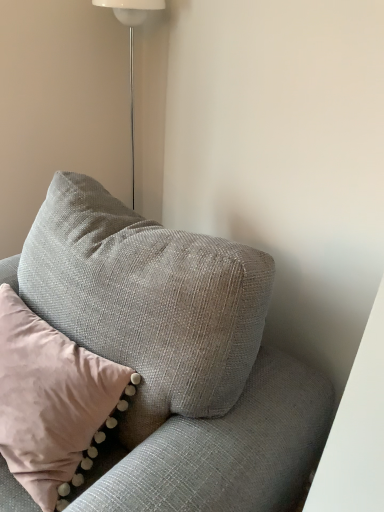
Question: From the image's perspective, is textured gray pillow at upper left under white glossy floor lamp at upper center?

Choices:
 (A) no
 (B) yes

Answer: (B)

Question: Could you tell me if textured gray pillow at upper left is turned towards white glossy floor lamp at upper center?

Choices:
 (A) no
 (B) yes

Answer: (A)

Question: Is white glossy floor lamp at upper center a part of textured gray pillow at upper left?

Choices:
 (A) no
 (B) yes

Answer: (A)

Question: Is textured gray pillow at upper left positioned beyond the bounds of white glossy floor lamp at upper center?

Choices:
 (A) yes
 (B) no

Answer: (A)

Question: Considering the relative sizes of textured gray pillow at upper left and white glossy floor lamp at upper center in the image provided, is textured gray pillow at upper left wider than white glossy floor lamp at upper center?

Choices:
 (A) yes
 (B) no

Answer: (A)

Question: In the image, is white glossy floor lamp at upper center on the left side or the right side of textured gray pillow at upper left?

Choices:
 (A) left
 (B) right

Answer: (B)

Question: Is point (124, 1) positioned closer to the camera than point (34, 463)?

Choices:
 (A) closer
 (B) farther

Answer: (B)

Question: From a real-world perspective, is white glossy floor lamp at upper center physically located above or below textured gray pillow at upper left?

Choices:
 (A) above
 (B) below

Answer: (A)

Question: Would you say white glossy floor lamp at upper center is inside or outside textured gray pillow at upper left?

Choices:
 (A) outside
 (B) inside

Answer: (A)

Question: In the image, is textured gray couch at upper right on the left side or the right side of textured gray pillow at upper left?

Choices:
 (A) right
 (B) left

Answer: (A)

Question: Is textured gray couch at upper right bigger or smaller than textured gray pillow at upper left?

Choices:
 (A) small
 (B) big

Answer: (B)

Question: Looking at their shapes, would you say textured gray couch at upper right is wider or thinner than textured gray pillow at upper left?

Choices:
 (A) thin
 (B) wide

Answer: (B)

Question: Considering their positions, is textured gray couch at upper right located in front of or behind textured gray pillow at upper left?

Choices:
 (A) front
 (B) behind

Answer: (A)

Question: From the image's perspective, relative to textured gray couch at upper right, is textured gray pillow at upper left above or below?

Choices:
 (A) below
 (B) above

Answer: (B)

Question: Is textured gray pillow at upper left taller or shorter than textured gray couch at upper right?

Choices:
 (A) short
 (B) tall

Answer: (A)